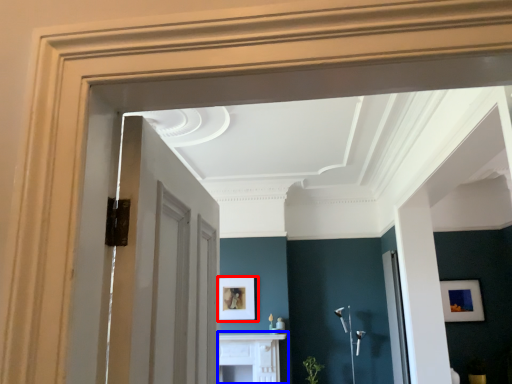
Question: Which of the following is the closest to the observer, picture frame (highlighted by a red box) or table (highlighted by a blue box)?

Choices:
 (A) picture frame
 (B) table

Answer: (B)